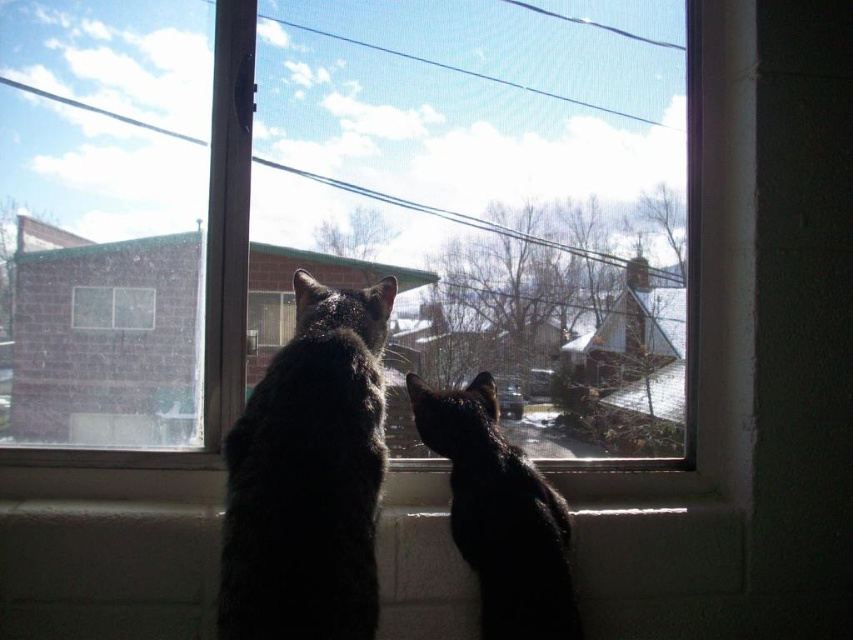
Which is behind, point (120, 294) or point (291, 580)?

Point (120, 294)

Which is in front, point (68, 120) or point (254, 451)?

Point (254, 451)

Does point (131, 250) come closer to viewer compared to point (239, 525)?

No, (131, 250) is behind (239, 525).

The image size is (853, 640). Identify the location of transparent glass window at center. (346, 214).

Does transparent glass window at center appear on the right side of black glossy cat at center?

In fact, transparent glass window at center is to the left of black glossy cat at center.

Based on the photo, can you confirm if transparent glass window at center is taller than black glossy cat at center?

Yes.

Does point (640, 454) lie in front of point (567, 634)?

No, it is behind (567, 634).

Where is `transparent glass window at center`? The width and height of the screenshot is (853, 640). transparent glass window at center is located at coordinates (346, 214).

Between point (257, 436) and point (555, 628), which one is positioned in front?

Point (257, 436) is in front.

Identify the location of dark fur cat at center. This screenshot has height=640, width=853. (309, 476).

The width and height of the screenshot is (853, 640). What do you see at coordinates (309, 476) in the screenshot?
I see `dark fur cat at center` at bounding box center [309, 476].

Identify the location of dark fur cat at center. (309, 476).